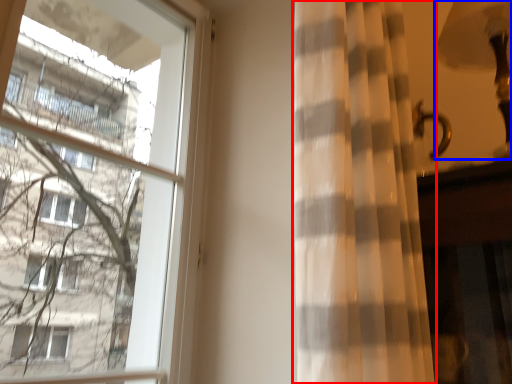
Question: Which point is further to the camera, curtain (highlighted by a red box) or table lamp (highlighted by a blue box)?

Choices:
 (A) curtain
 (B) table lamp

Answer: (B)